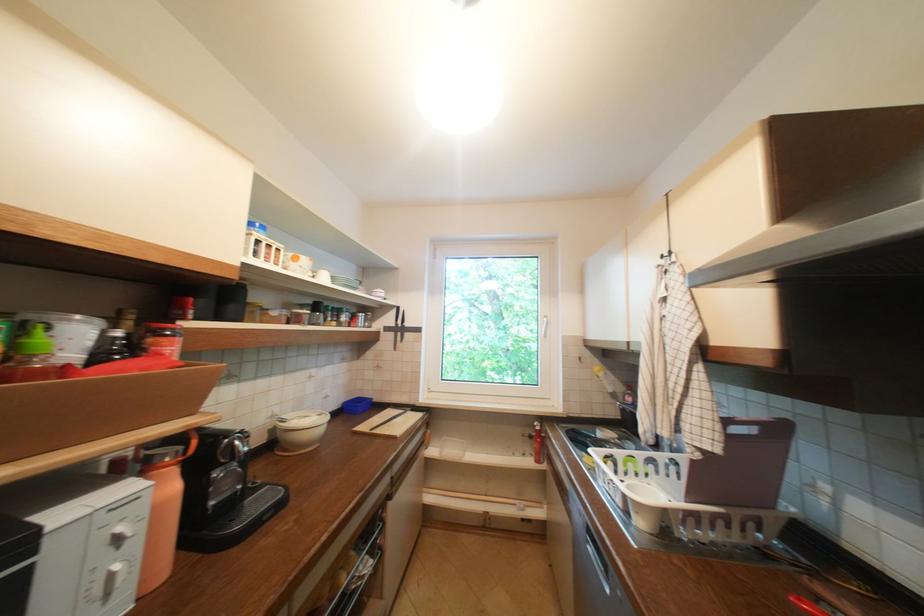
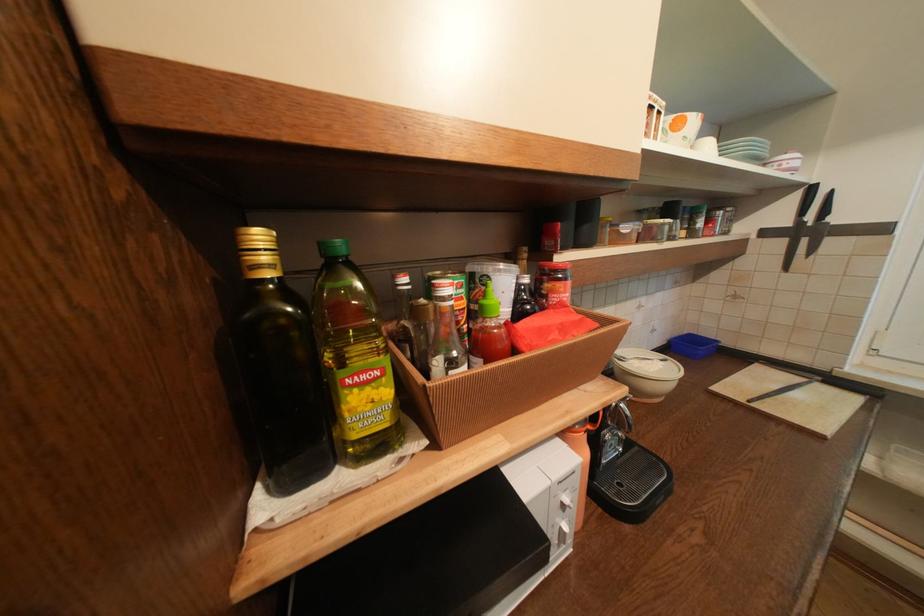
Locate, in the second image, the point that corresponds to the point at 326,418 in the first image.

(670, 363)